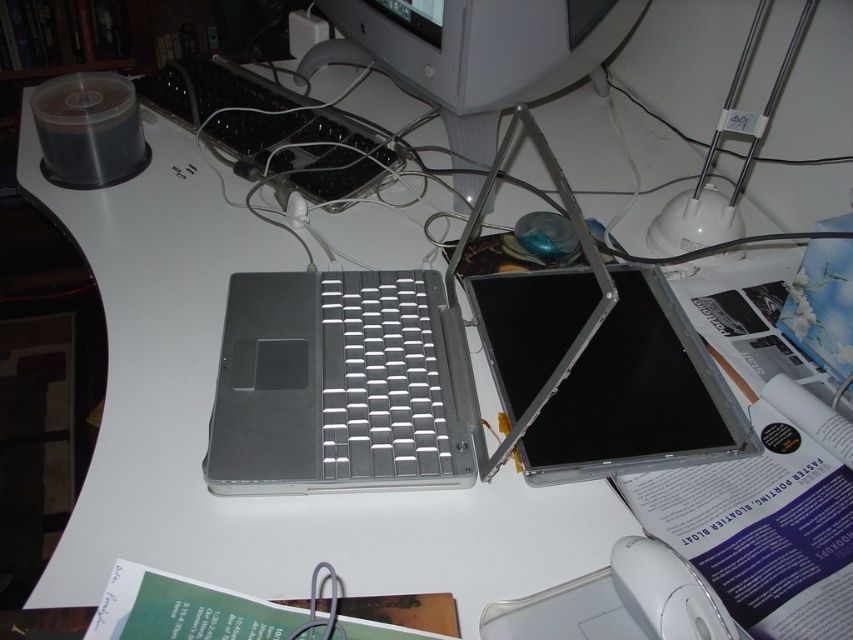
Can you confirm if silver metallic laptop at center is positioned to the right of matte gray monitor at upper center?

In fact, silver metallic laptop at center is to the left of matte gray monitor at upper center.

Which of these two, silver metallic laptop at center or matte gray monitor at upper center, stands shorter?

Standing shorter between the two is matte gray monitor at upper center.

Is point (287, 337) closer to camera compared to point (444, 115)?

Yes.

This screenshot has height=640, width=853. I want to click on silver metallic laptop at center, so click(366, 372).

Is silver metallic laptop at center positioned in front of silver metallic keyboard at center?

Yes, silver metallic laptop at center is closer to the viewer.

The image size is (853, 640). Find the location of `silver metallic laptop at center`. silver metallic laptop at center is located at coordinates (366, 372).

Is the position of matte gray monitor at upper center more distant than that of silver metallic keyboard at center?

No, it is in front of silver metallic keyboard at center.

Is matte gray monitor at upper center smaller than silver metallic keyboard at center?

Actually, matte gray monitor at upper center might be larger than silver metallic keyboard at center.

Which is behind, point (303, 67) or point (224, 74)?

The point (303, 67) is more distant.

What are the coordinates of `matte gray monitor at upper center` in the screenshot? It's located at (476, 54).